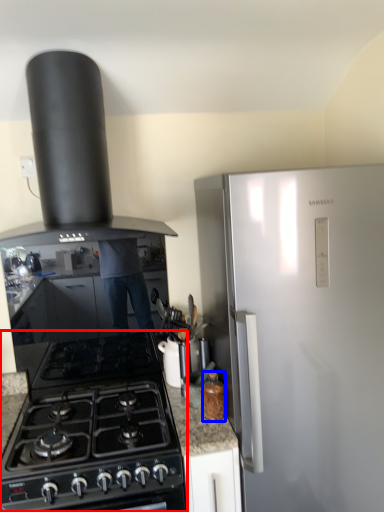
Question: Among these objects, which one is farthest to the camera, gas stove (highlighted by a red box) or kitchen appliance (highlighted by a blue box)?

Choices:
 (A) gas stove
 (B) kitchen appliance

Answer: (B)